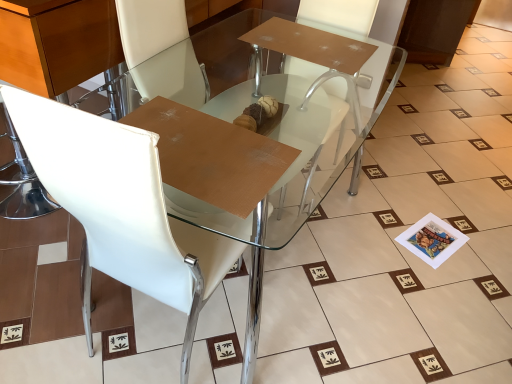
Question: Looking at their shapes, would you say white leather chair at upper left is wider or thinner than white leather armchair at center?

Choices:
 (A) wide
 (B) thin

Answer: (A)

Question: Choose the correct answer: Is white leather chair at upper left inside white leather armchair at center or outside it?

Choices:
 (A) inside
 (B) outside

Answer: (B)

Question: Which is nearer to the transparent glass table at center?

Choices:
 (A) white leather armchair at center
 (B) white leather chair at upper left

Answer: (A)

Question: Which of these objects is positioned closest to the transparent glass table at center?

Choices:
 (A) white leather chair at upper left
 (B) white leather armchair at center

Answer: (B)